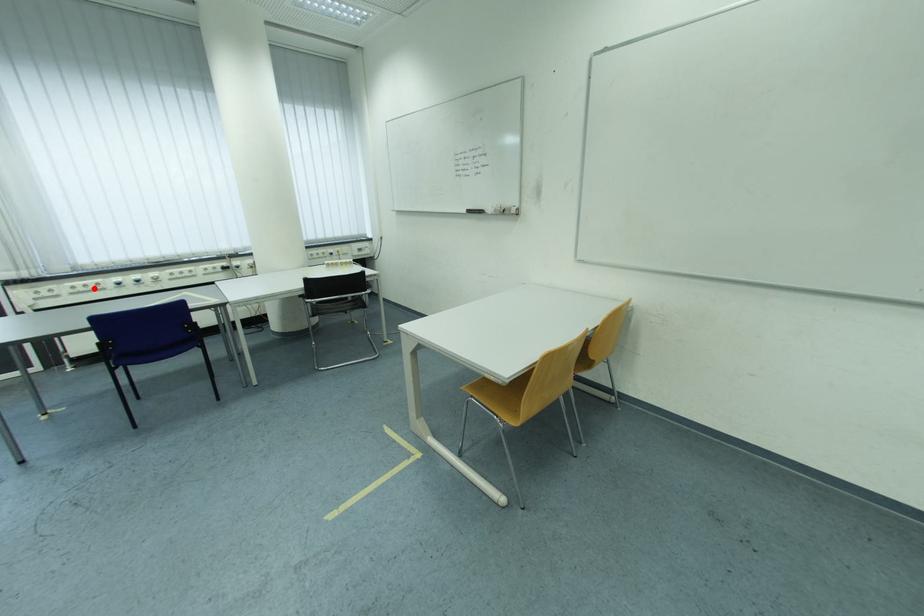
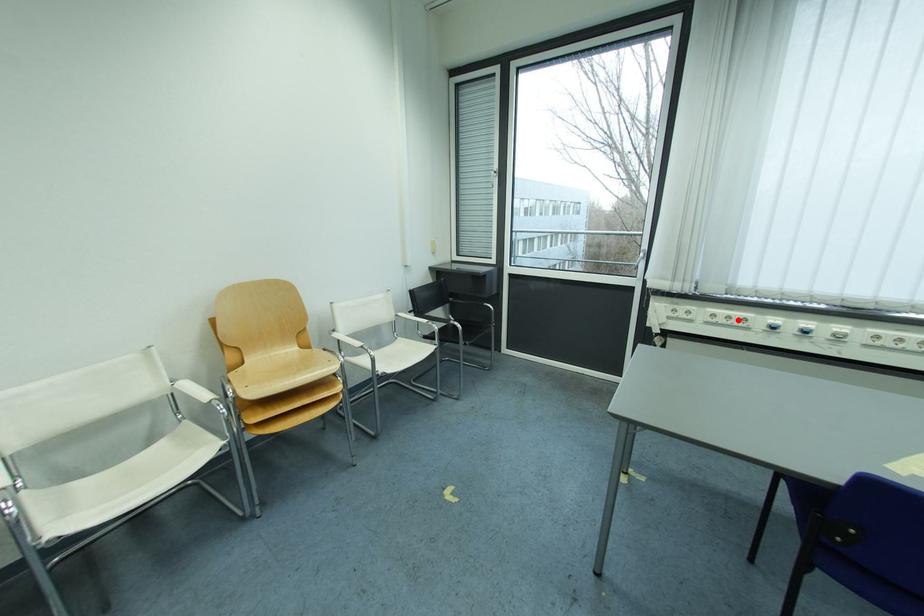
I am providing you with two images of the same scene from different viewpoints. A red point is marked on the first image and another point is marked on the second image. Do the highlighted points in image1 and image2 indicate the same real-world spot?

Yes